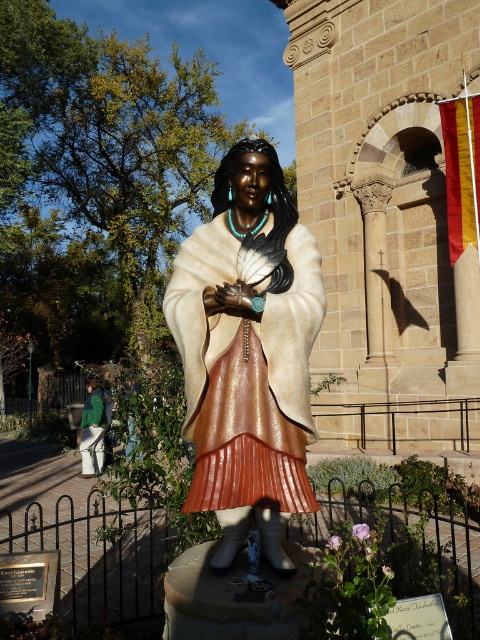
You are standing at the base of the bronze statue of a Native American woman. You notice two points marked in the scene. The first point is at coordinates point (248, 163) and the second is at point (96, 470). If you were to walk from the first point to the second point, would you be moving towards the statue or away from it?

Moving towards the statue. Since point (248, 163) is in front of point (96, 470), walking from the first to the second point would mean moving closer to the statue.

In the scene shown: You are a visitor at the statue and see the matte bronze statue at center and the green fabric pants at lower left. Which object is higher in the scene?

The matte bronze statue at center is higher than the green fabric pants at lower left.

You are a tour guide explaining the layout of the historical site. Where is the matte bronze statue at center positioned in relation to the stone building with arched windows and columns?

The matte bronze statue at center is positioned in front of the stone building with arched windows and columns, as described in the scene.